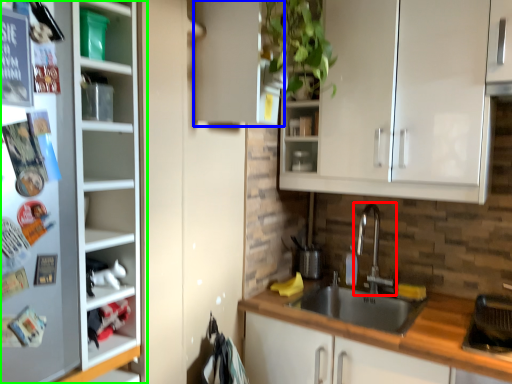
Question: Based on their relative distances, which object is nearer to tap (highlighted by a red box)? Choose from cabinetry (highlighted by a blue box) and cupboard (highlighted by a green box).

Choices:
 (A) cabinetry
 (B) cupboard

Answer: (A)